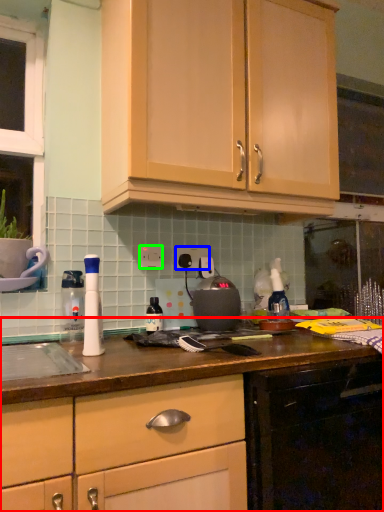
Question: Considering the real-world distances, which object is closest to cabinetry (highlighted by a red box)? electric outlet (highlighted by a blue box) or electric outlet (highlighted by a green box).

Choices:
 (A) electric outlet
 (B) electric outlet

Answer: (B)